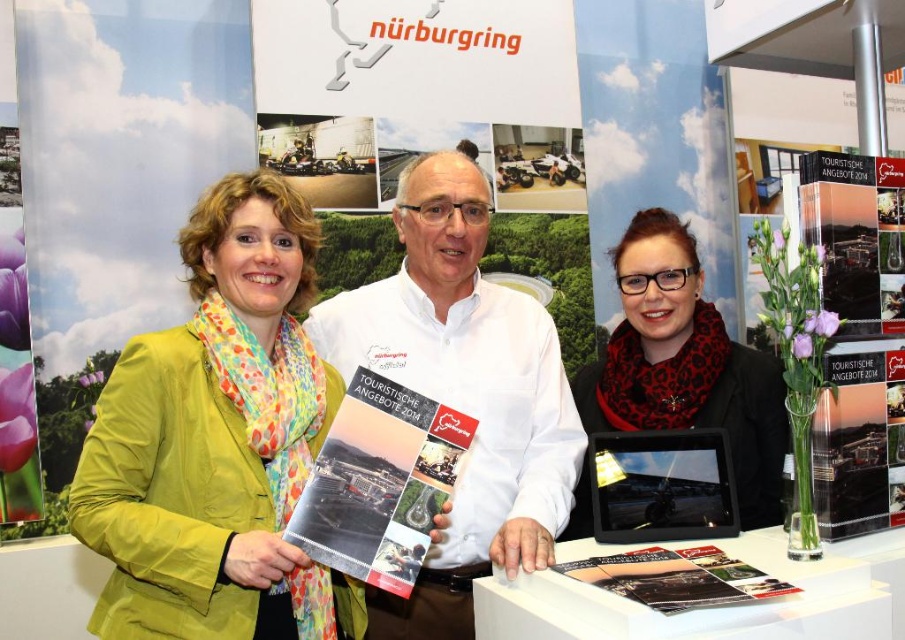
Question: Which point appears closest to the camera in this image?

Choices:
 (A) (365, 561)
 (B) (90, 529)
 (C) (640, 305)
 (D) (443, 244)

Answer: (B)

Question: Can you confirm if green fabric jacket at left is positioned below red scarf at center?

Choices:
 (A) no
 (B) yes

Answer: (B)

Question: Which object is positioned closest to the matte paper brochure at center?

Choices:
 (A) green fabric jacket at left
 (B) red scarf at center
 (C) white paper at center

Answer: (A)

Question: In this image, where is green fabric jacket at left located relative to white paper at center?

Choices:
 (A) above
 (B) below

Answer: (B)

Question: Can you confirm if white paper at center is wider than matte paper brochure at center?

Choices:
 (A) yes
 (B) no

Answer: (A)

Question: Which of the following is the closest to the observer?

Choices:
 (A) (500, 424)
 (B) (399, 515)
 (C) (731, 365)

Answer: (B)